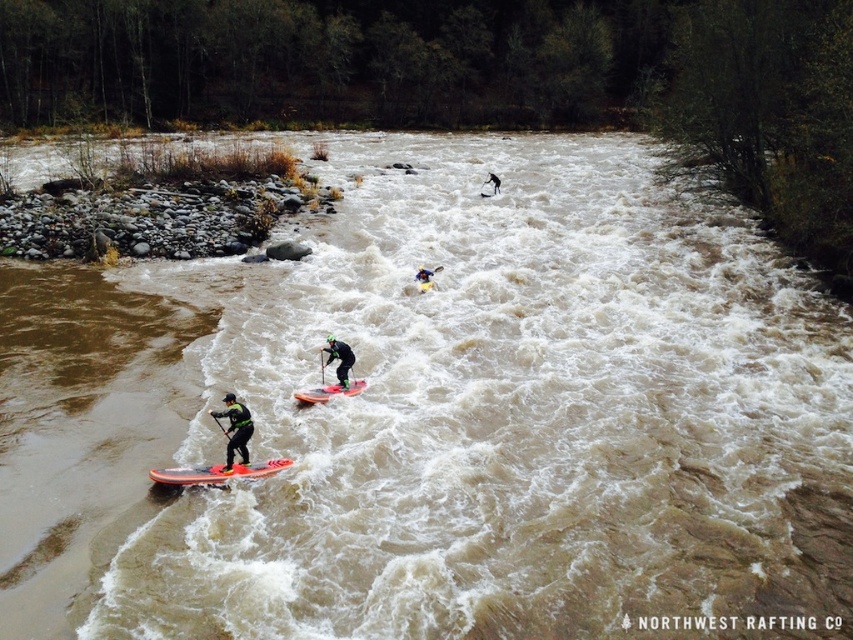
You are a photographer trying to capture the scene from the riverbank. You want to ensure both the black matte paddleboard at lower left and the green neoprene jacket at center are clearly visible in your shot. Since the river is quite turbulent, you need to adjust your camera angle to focus on the taller object first. Which object should you prioritize focusing on first?

The black matte paddleboard at lower left has a greater height compared to the green neoprene jacket at center, so you should prioritize focusing on the black matte paddleboard at lower left first.

You are a photographer trying to capture the black matte paddleboard at lower left. The camera is positioned at point 0.5, 0.5. What direction should you move the camera to focus on the paddleboard?

The black matte paddleboard at lower left is located at point (235, 428). Since the camera is at (426, 320), you need to move the camera to the right and down to focus on the paddleboard.

You are a photographer trying to capture the rafting scene. You want to focus on the black matte paddleboard at lower left. The camera is currently pointing at point (235, 428). Is the camera already pointing at the correct subject?

Yes, the camera is already pointing at the correct subject because the point (235, 428) corresponds to the black matte paddleboard at lower left.